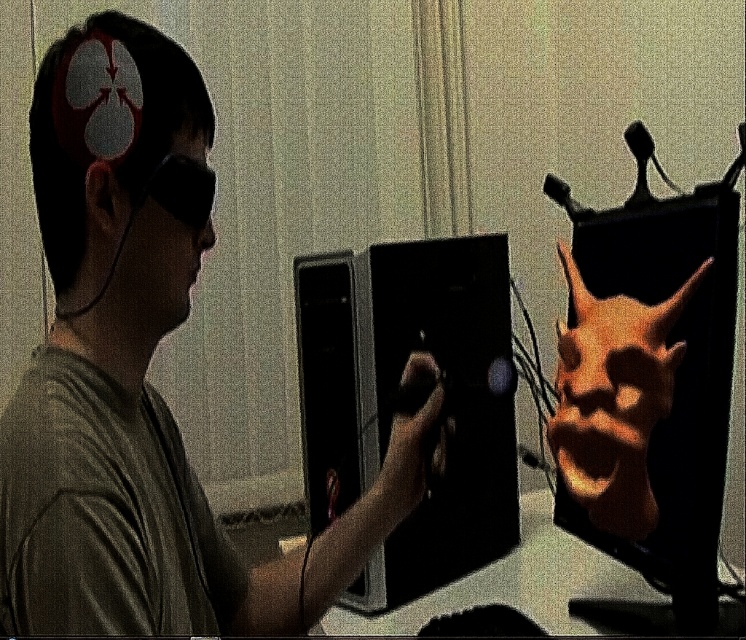
Question: Is black glossy monitor at center bigger than matte black face at left?

Choices:
 (A) no
 (B) yes

Answer: (B)

Question: Which object is farther from the camera taking this photo?

Choices:
 (A) matte black laptop at left
 (B) matte black face at left

Answer: (B)

Question: Which of these objects is positioned farthest from the matte black headphones at left?

Choices:
 (A) matte black face at left
 (B) orange matte mask at right

Answer: (B)

Question: Which point appears farthest from the camera in this image?

Choices:
 (A) (153, 410)
 (B) (163, 67)
 (C) (656, 378)

Answer: (A)

Question: Is matte black laptop at left above orange matte mask at right?

Choices:
 (A) no
 (B) yes

Answer: (A)

Question: Does matte black laptop at left lie in front of black glossy monitor at center?

Choices:
 (A) no
 (B) yes

Answer: (B)